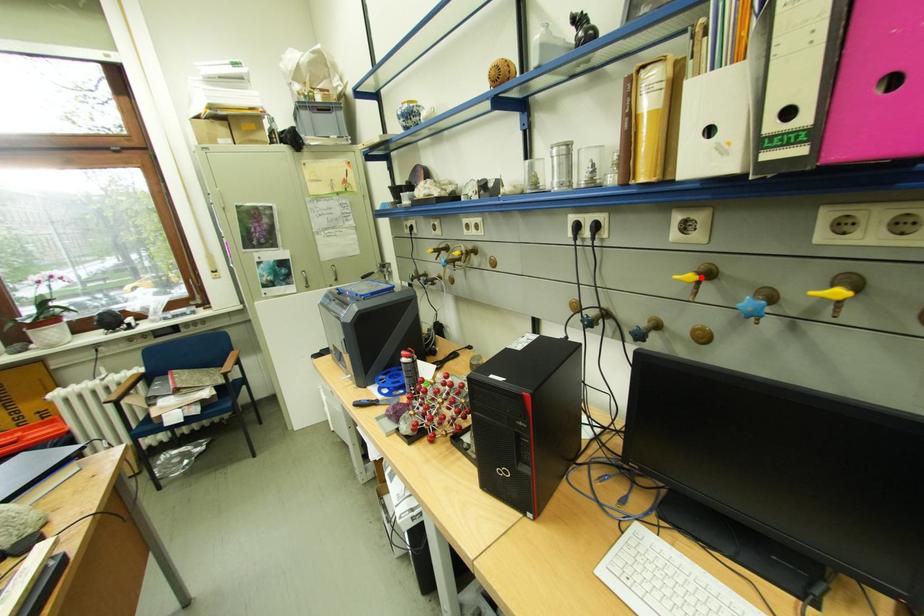
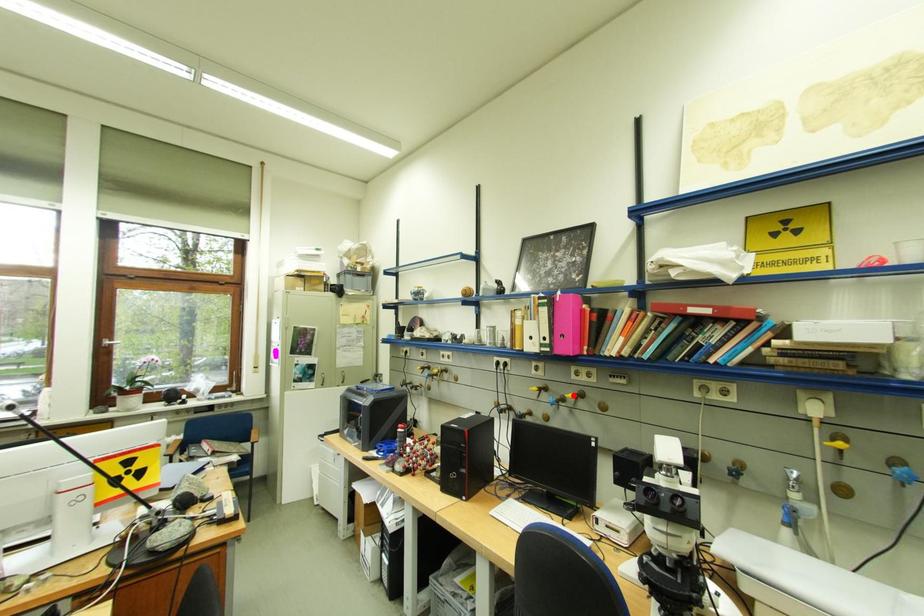
I am providing you with two images of the same scene from different viewpoints. A red point is marked on the first image and another point is marked on the second image. Is the marked point in image1 the same physical position as the marked point in image2?

No